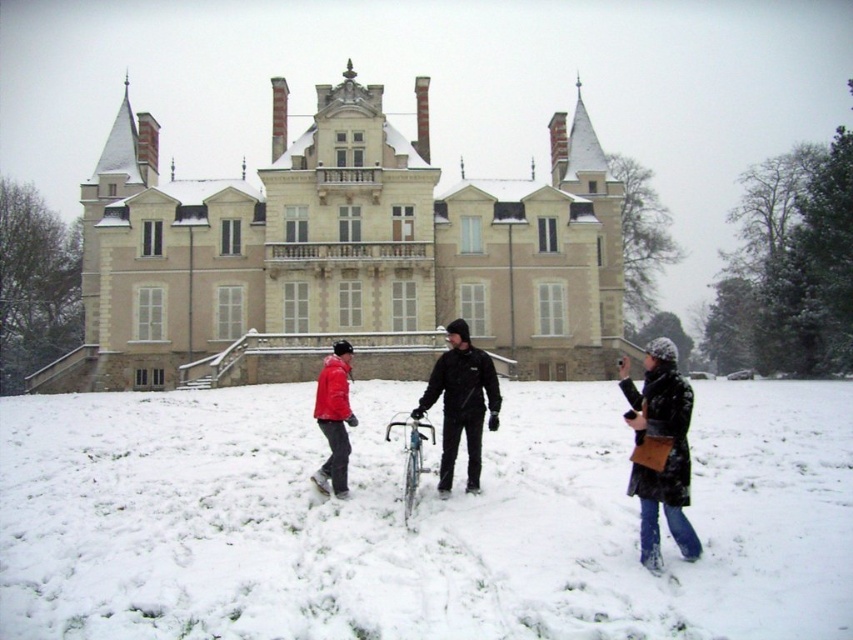
Question: Which point is farther to the camera?

Choices:
 (A) (653, 545)
 (B) (448, 515)

Answer: (B)

Question: Based on their relative distances, which object is farther from the matte red jacket at center?

Choices:
 (A) beige stone palace at center
 (B) black textured coat at lower right
 (C) white fluffy snow at center
 (D) black matte jacket at center

Answer: (A)

Question: Is black textured coat at lower right to the left of matte red jacket at center from the viewer's perspective?

Choices:
 (A) no
 (B) yes

Answer: (A)

Question: From the image, what is the correct spatial relationship of white fluffy snow at center in relation to black matte jacket at center?

Choices:
 (A) below
 (B) above

Answer: (A)

Question: Estimate the real-world distances between objects in this image. Which object is closer to the white fluffy snow at center?

Choices:
 (A) black matte jacket at center
 (B) beige stone palace at center

Answer: (A)

Question: Is beige stone palace at center bigger than black textured coat at lower right?

Choices:
 (A) no
 (B) yes

Answer: (B)